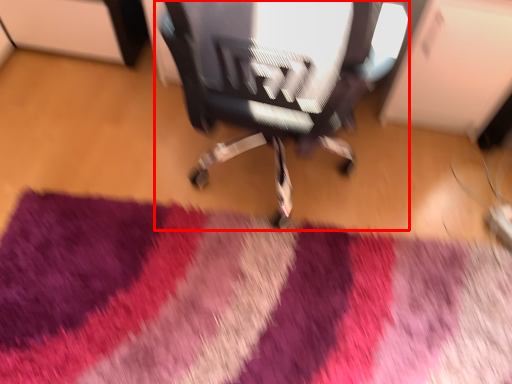
Question: From the image's perspective, where is chair (annotated by the red box) located relative to mat?

Choices:
 (A) below
 (B) above

Answer: (B)